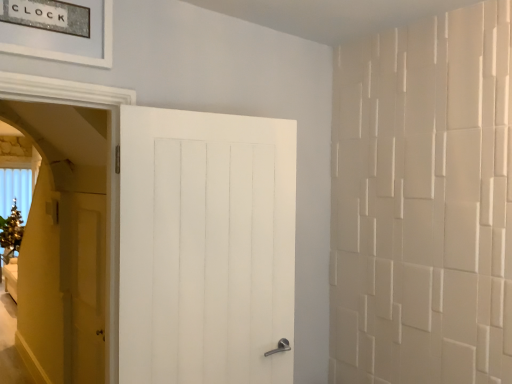
Question: Which direction should I rotate to look at white wooden door at center, which is counted as the 2th door, starting from the back, — up or down?

Choices:
 (A) down
 (B) up

Answer: (A)

Question: Is white wooden door at center, the second door viewed from the left, taller than matte wood door at left, which appears as the 2th door when viewed from the front?

Choices:
 (A) no
 (B) yes

Answer: (B)

Question: Would you say white wooden door at center, which is counted as the 2th door, starting from the back, contains matte wood door at left, which appears as the 2th door when viewed from the front?

Choices:
 (A) no
 (B) yes

Answer: (A)

Question: Is white wooden door at center, the first door viewed from the right, closer to camera compared to matte wood door at left, which appears as the 2th door when viewed from the front?

Choices:
 (A) yes
 (B) no

Answer: (A)

Question: Can you confirm if white wooden door at center, the 1th door in the front-to-back sequence, is bigger than matte wood door at left, the first door positioned from the back?

Choices:
 (A) yes
 (B) no

Answer: (A)

Question: From a real-world perspective, is white wooden door at center, which is counted as the 2th door, starting from the back, over matte wood door at left, which appears as the 2th door when viewed from the front?

Choices:
 (A) no
 (B) yes

Answer: (B)

Question: Considering the relative sizes of white wooden door at center, which is counted as the 2th door, starting from the back, and matte wood door at left, placed as the 2th door when sorted from right to left, in the image provided, is white wooden door at center, which is counted as the 2th door, starting from the back, wider than matte wood door at left, placed as the 2th door when sorted from right to left,?

Choices:
 (A) yes
 (B) no

Answer: (A)

Question: Can you confirm if matte wood door at left, which is the first door from left to right, is smaller than white wooden door at center, the second door viewed from the left?

Choices:
 (A) no
 (B) yes

Answer: (B)

Question: Considering the relative sizes of matte wood door at left, which is the first door from left to right, and white wooden door at center, the first door viewed from the right, in the image provided, is matte wood door at left, which is the first door from left to right, shorter than white wooden door at center, the first door viewed from the right,?

Choices:
 (A) no
 (B) yes

Answer: (B)

Question: Is white wooden door at center, the first door viewed from the right, inside matte wood door at left, placed as the 2th door when sorted from right to left?

Choices:
 (A) no
 (B) yes

Answer: (A)

Question: Is matte wood door at left, the first door positioned from the back, positioned before white wooden door at center, the 1th door in the front-to-back sequence?

Choices:
 (A) no
 (B) yes

Answer: (A)

Question: From the image's perspective, does matte wood door at left, the first door positioned from the back, appear higher than white wooden door at center, the 1th door in the front-to-back sequence?

Choices:
 (A) yes
 (B) no

Answer: (B)

Question: Can you confirm if matte wood door at left, which is the first door from left to right, is positioned to the right of white wooden door at center, which is counted as the 2th door, starting from the back?

Choices:
 (A) yes
 (B) no

Answer: (B)

Question: Based on their positions, is white wooden door at center, the 1th door in the front-to-back sequence, located to the left or right of matte wood door at left, placed as the 2th door when sorted from right to left?

Choices:
 (A) right
 (B) left

Answer: (A)